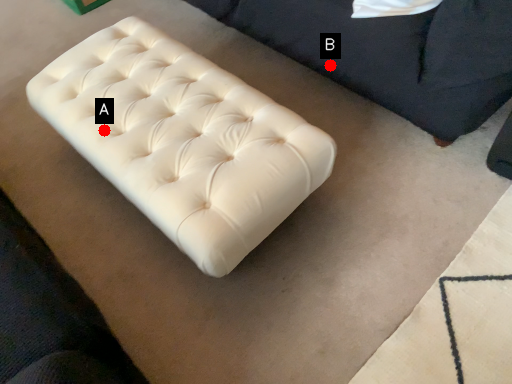
Question: Two points are circled on the image, labeled by A and B beside each circle. Which of the following is the closest to the observer?

Choices:
 (A) A is closer
 (B) B is closer

Answer: (A)